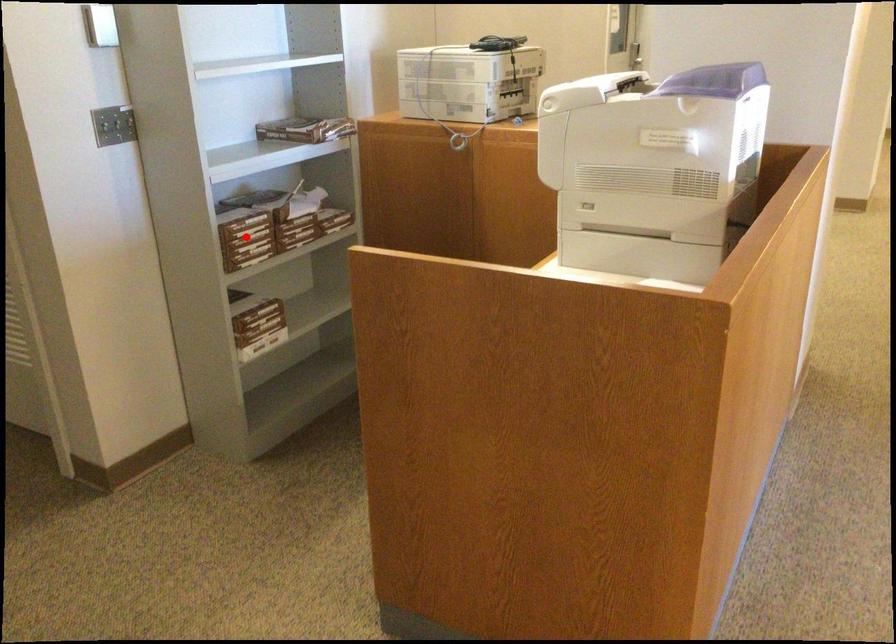
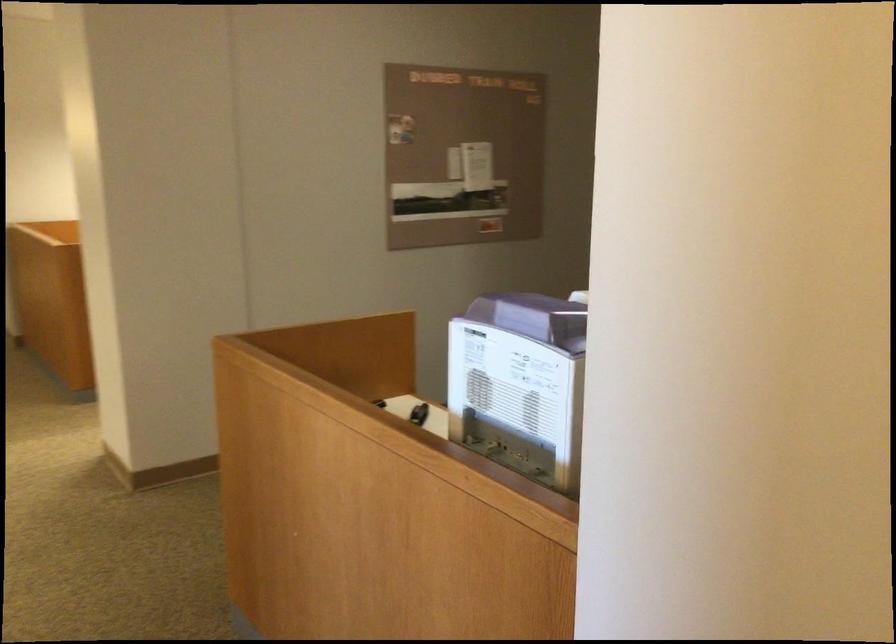
Question: I am providing you with two images of the same scene from different viewpoints. A red point is marked on the first image. Is the red point's position out of view in image 2?

Choices:
 (A) Yes
 (B) No

Answer: (A)